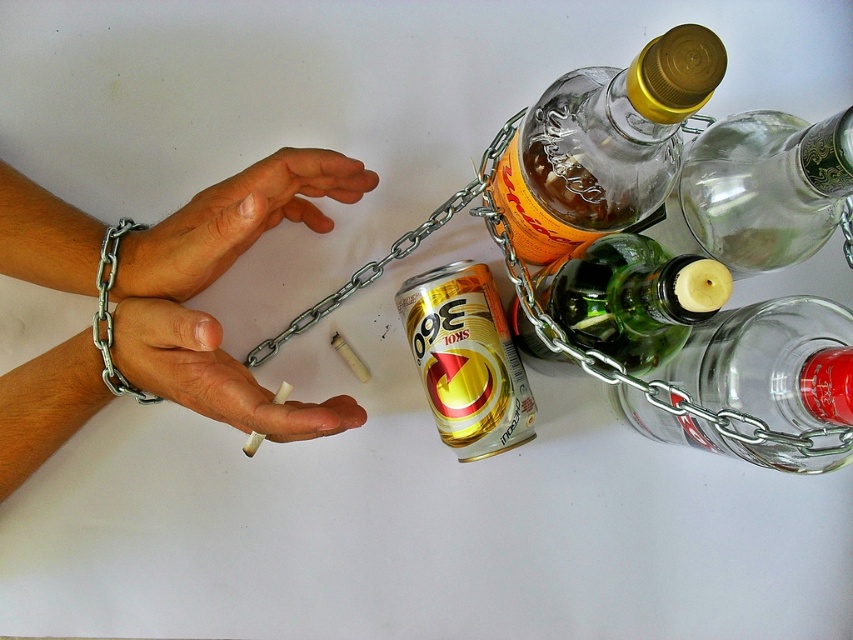
Does translucent glass bottle at upper right come in front of green glass bottle at lower right?

Yes, translucent glass bottle at upper right is closer to the viewer.

Is point (595, 212) positioned after point (747, 461)?

No, (595, 212) is in front of (747, 461).

Locate an element on the screen. The width and height of the screenshot is (853, 640). translucent glass bottle at upper right is located at coordinates (604, 144).

From the picture: Between metal chain at left and dry skin at left, which one appears on the left side from the viewer's perspective?

Positioned to the left is metal chain at left.

Find the location of a particular element. metal chain at left is located at coordinates pos(215,280).

Locate an element on the screen. metal chain at left is located at coordinates tap(215, 280).

Who is positioned more to the left, green glass bottle at lower right or gold metallic can at center?

gold metallic can at center

Is green glass bottle at lower right bigger than gold metallic can at center?

Indeed, green glass bottle at lower right has a larger size compared to gold metallic can at center.

Image resolution: width=853 pixels, height=640 pixels. Find the location of `green glass bottle at lower right`. green glass bottle at lower right is located at coordinates (770, 364).